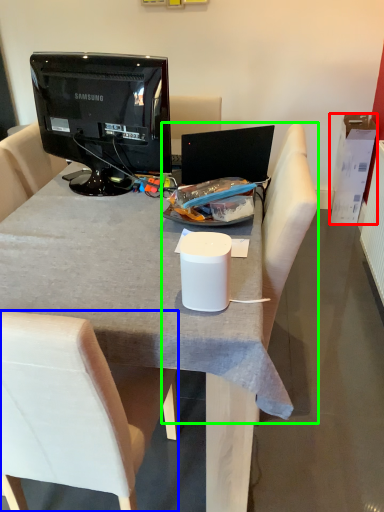
Question: Considering the real-world distances, which object is closest to box (highlighted by a red box)? chair (highlighted by a blue box) or armchair (highlighted by a green box).

Choices:
 (A) chair
 (B) armchair

Answer: (B)